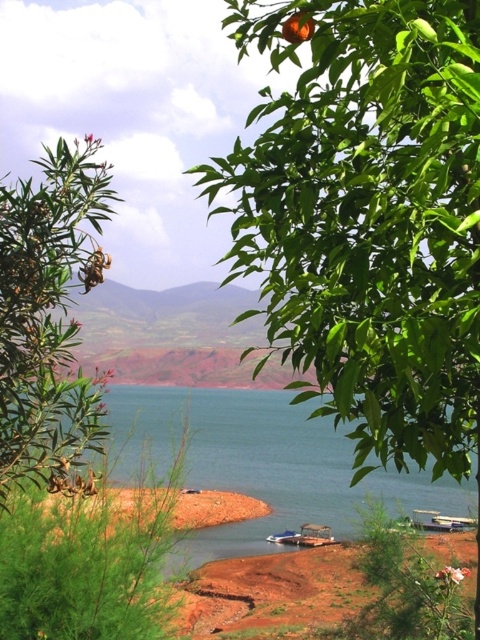
You are standing at the edge of the lake and want to locate the blue water at center. Based on the coordinates provided, in which direction should you look to find it?

The blue water at center is located at coordinates point (261,464). Since the x coordinate is 0.725, which is to the right of the center point, and the y coordinate is 0.544, which is slightly above the center point, you should look to the right and slightly upwards to find the blue water at center.

You are standing at the center of the scene and want to take a photo of the green leafy tree at upper right. Which direction should you face to ensure the tree is in the frame?

Since the green leafy tree at upper right is located at coordinates 0.342 on the x and 0.769 on the y axis, you should face towards the upper right direction to capture it in your photo.